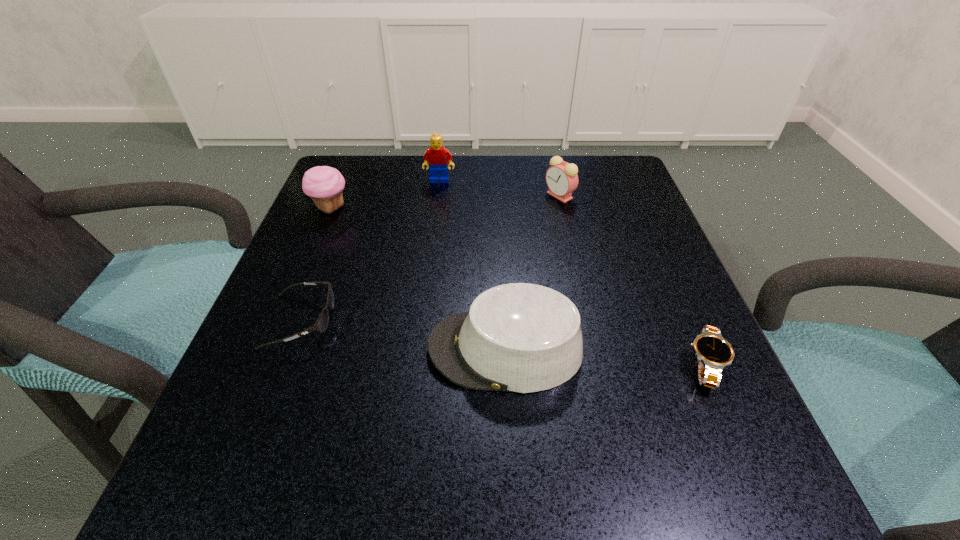
This screenshot has width=960, height=540. I want to click on vacant point at the right edge, so click(701, 395).

In the image, there is a desktop. Identify the location of vacant space at the far left corner. The width and height of the screenshot is (960, 540). (362, 156).

In the image, there is a desktop. Identify the location of free region at the far right corner. (576, 164).

In the image, there is a desktop. At what (x,y) coordinates should I click in order to perform the action: click on vacant space at the near right corner. Please return your answer as a coordinate pair (x, y). The width and height of the screenshot is (960, 540). Looking at the image, I should click on (660, 498).

The width and height of the screenshot is (960, 540). In order to click on vacant area between the alarm clock and the shortest object in this screenshot , I will do `click(632, 280)`.

This screenshot has width=960, height=540. What are the coordinates of `free space between the sunglasses and the alarm clock` in the screenshot? It's located at (430, 259).

Locate an element on the screen. This screenshot has width=960, height=540. empty space between the watch and the farthest object is located at coordinates (572, 273).

At what (x,y) coordinates should I click in order to perform the action: click on empty space between the fifth tallest object and the Lego. Please return your answer as a coordinate pair (x, y). Image resolution: width=960 pixels, height=540 pixels. Looking at the image, I should click on (370, 251).

I want to click on vacant area that lies between the shortest object and the Lego, so click(572, 273).

At what (x,y) coordinates should I click in order to perform the action: click on vacant area that lies between the sunglasses and the hat. Please return your answer as a coordinate pair (x, y). This screenshot has width=960, height=540. Looking at the image, I should click on (403, 335).